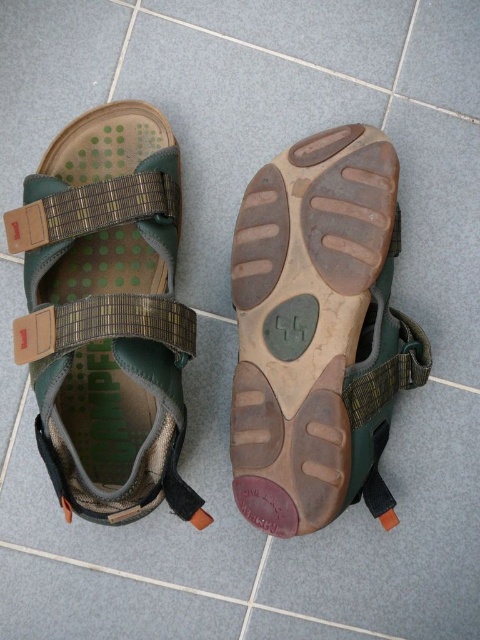
Who is positioned more to the left, brown rubber sandal at center or green fabric sandal at center?

From the viewer's perspective, green fabric sandal at center appears more on the left side.

Is point (331, 500) positioned in front of point (113, 314)?

No, (331, 500) is further to viewer.

Which is behind, point (326, 170) or point (64, 168)?

The point (64, 168) is more distant.

Find the location of `brown rubber sandal at center`. brown rubber sandal at center is located at coordinates (317, 332).